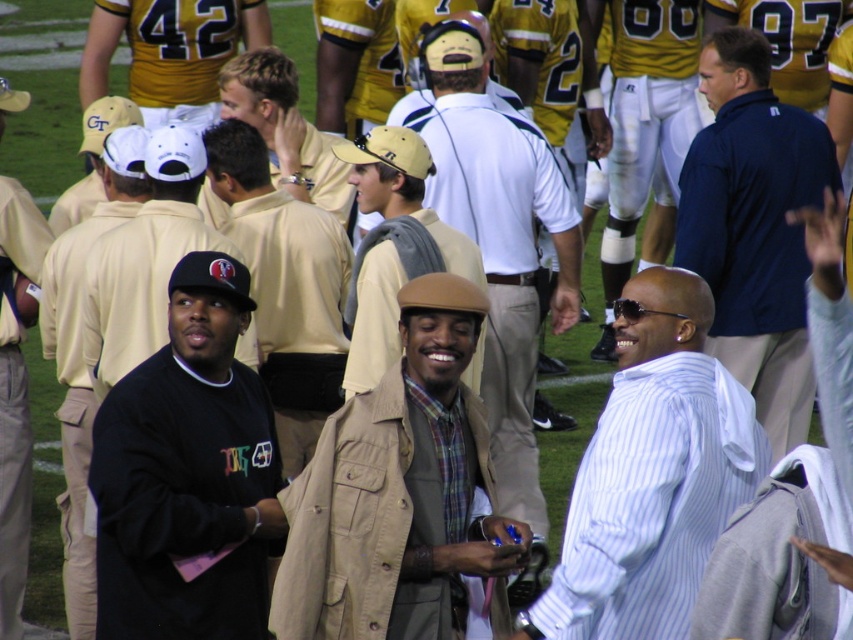
You are standing at the origin of the coordinate system in the image. You want to walk to the point at the bottom right corner of the image. However, there are two points in the image that you need to consider. The first point is at coordinate point(666,346) and the second point is at coordinate point(18,552). Based on their positions, which point is closer to your starting position?

The point at coordinate point(18,552) is closer to the origin because it is located at the bottom right corner of the image, which aligns with the direction you are moving towards.

You are a photographer at the football game and want to capture both the black matte sweatshirt at center and the tan fabric jacket at center in the same frame. Which object should you focus on first to ensure both are in the frame?

The black matte sweatshirt at center has a smaller size compared to the tan fabric jacket at center. Therefore, you should focus on the tan fabric jacket at center first since it is larger and will be easier to frame, ensuring the smaller black matte sweatshirt at center is also captured in the shot.

You are a photographer trying to capture a group photo of the black matte sweatshirt at center and the tan fabric jacket at center. You want to ensure both are fully visible in the frame. Which object should you position closer to the camera to avoid cropping?

The black matte sweatshirt at center has a smaller width than the tan fabric jacket at center. Position the black matte sweatshirt at center closer to the camera so its smaller size can be better accommodated in the frame without cropping both subjects.